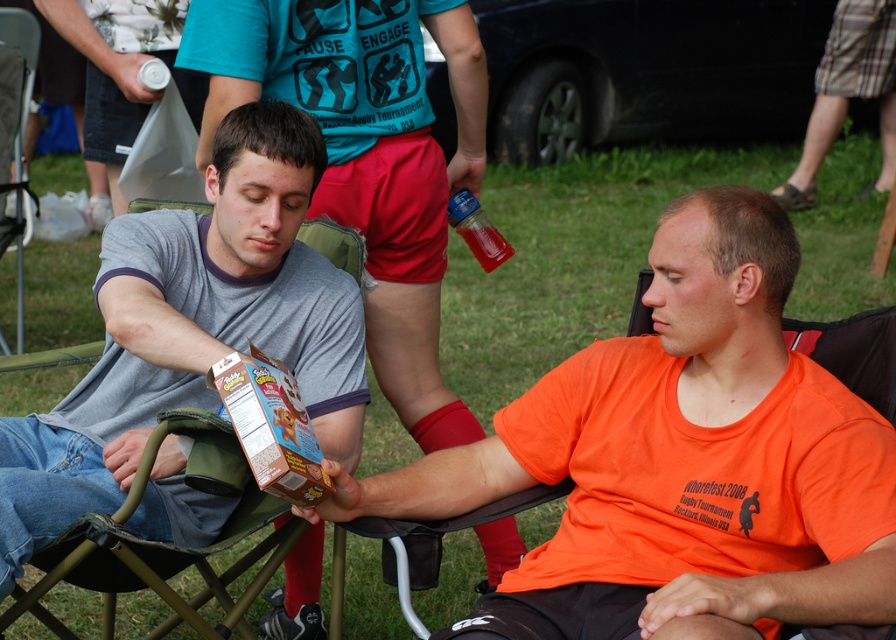
Is point (330, 404) positioned behind point (418, 120)?

That is False.

Who is shorter, gray cotton shirt at left or matte gray shirt at center?

gray cotton shirt at left is shorter.

Which is in front, point (134, 452) or point (429, 298)?

Point (134, 452)

Image resolution: width=896 pixels, height=640 pixels. Identify the location of gray cotton shirt at left. (255, 268).

Which is behind, point (884, 564) or point (221, 182)?

Positioned behind is point (221, 182).

Does orange matte shirt at center lie behind gray cotton shirt at left?

No, orange matte shirt at center is in front of gray cotton shirt at left.

Is point (552, 438) positioned behind point (208, 291)?

No.

Where is `orange matte shirt at center`? orange matte shirt at center is located at coordinates (720, 308).

Can you confirm if orange matte shirt at center is positioned to the right of matte gray shirt at center?

Indeed, orange matte shirt at center is positioned on the right side of matte gray shirt at center.

This screenshot has width=896, height=640. What do you see at coordinates (720, 308) in the screenshot? I see `orange matte shirt at center` at bounding box center [720, 308].

Find the location of a particular element. orange matte shirt at center is located at coordinates (720, 308).